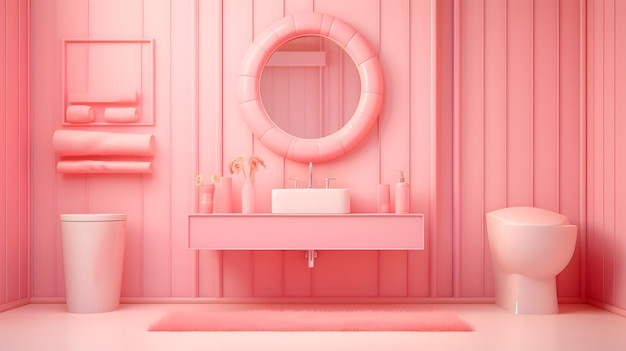
The height and width of the screenshot is (351, 626). Find the location of `mirror`. mirror is located at coordinates (307, 93).